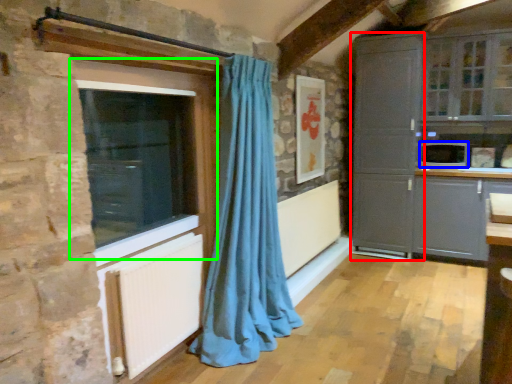
Question: Which object is positioned closest to screen door (highlighted by a red box)? Select from appliance (highlighted by a blue box) and window (highlighted by a green box).

Choices:
 (A) appliance
 (B) window

Answer: (A)